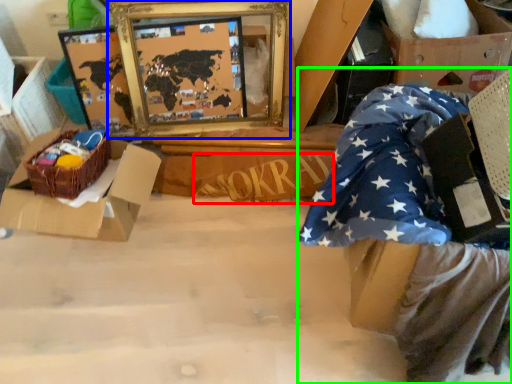
Question: Which object is the closest to the writing (highlighted by a red box)? Choose among these: picture frame (highlighted by a blue box) or person (highlighted by a green box).

Choices:
 (A) picture frame
 (B) person

Answer: (A)